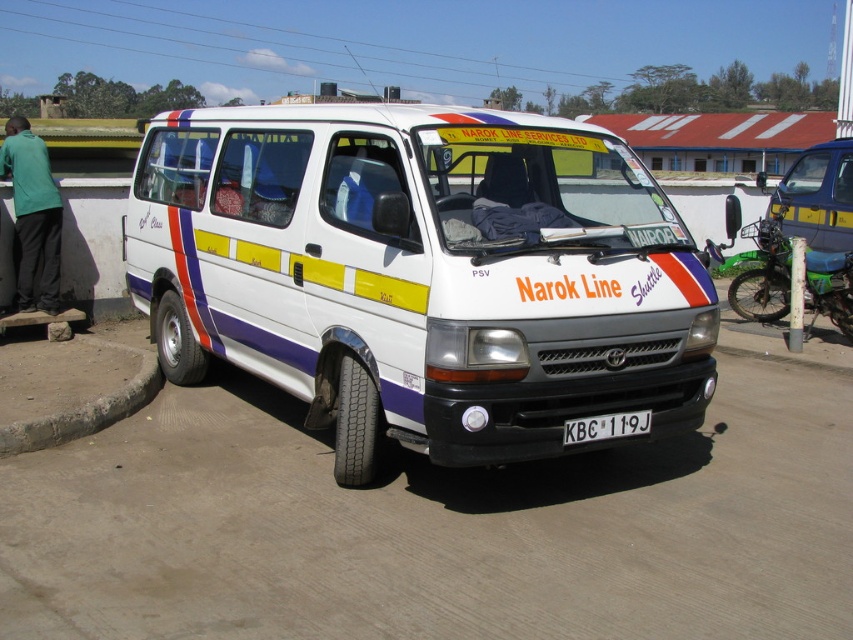
Based on the scene description, where is the dirt track at center located in terms of coordinates?

The dirt track at center is located at coordinates (436, 528).

You are standing at the dirt track at center and want to see the green fabric shirt at left. Which direction should you look to see the higher object?

The green fabric shirt at left is taller than the dirt track at center, so you should look upward to see the higher object.

You are a delivery person trying to park your van in a narrow space. You see the white glossy van at center and the black plastic license plate at center in the image. Which object is wider?

The white glossy van at center is wider than the black plastic license plate at center.